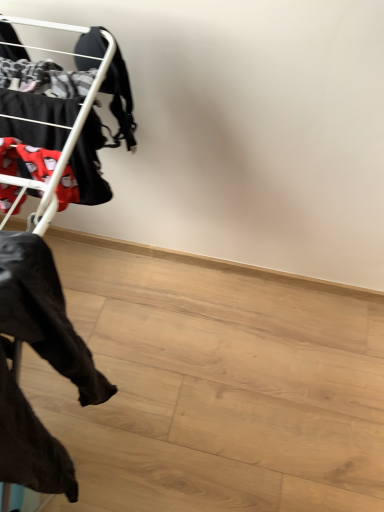
Question: Is the surface of black fabric pants at left in direct contact with matte black clothing rack at left?

Choices:
 (A) no
 (B) yes

Answer: (A)

Question: Is black fabric pants at left completely or partially outside of matte black clothing rack at left?

Choices:
 (A) yes
 (B) no

Answer: (A)

Question: Does black fabric pants at left appear on the right side of matte black clothing rack at left?

Choices:
 (A) yes
 (B) no

Answer: (A)

Question: From the image's perspective, is black fabric pants at left under matte black clothing rack at left?

Choices:
 (A) yes
 (B) no

Answer: (A)

Question: Considering the relative sizes of black fabric pants at left and matte black clothing rack at left in the image provided, is black fabric pants at left wider than matte black clothing rack at left?

Choices:
 (A) no
 (B) yes

Answer: (A)

Question: From the image's perspective, does black fabric pants at left appear higher than matte black clothing rack at left?

Choices:
 (A) no
 (B) yes

Answer: (A)

Question: Is matte black clothing rack at left thinner than black fabric pants at left?

Choices:
 (A) no
 (B) yes

Answer: (A)

Question: From a real-world perspective, is matte black clothing rack at left physically above black fabric pants at left?

Choices:
 (A) yes
 (B) no

Answer: (A)

Question: Does matte black clothing rack at left appear on the right side of black fabric pants at left?

Choices:
 (A) yes
 (B) no

Answer: (B)

Question: Does matte black clothing rack at left turn towards black fabric pants at left?

Choices:
 (A) no
 (B) yes

Answer: (A)

Question: Does matte black clothing rack at left have a lesser height compared to black fabric pants at left?

Choices:
 (A) yes
 (B) no

Answer: (A)

Question: Is matte black clothing rack at left far from black fabric pants at left?

Choices:
 (A) no
 (B) yes

Answer: (A)

Question: Is black fabric pants at left to the left or to the right of matte black clothing rack at left in the image?

Choices:
 (A) right
 (B) left

Answer: (A)